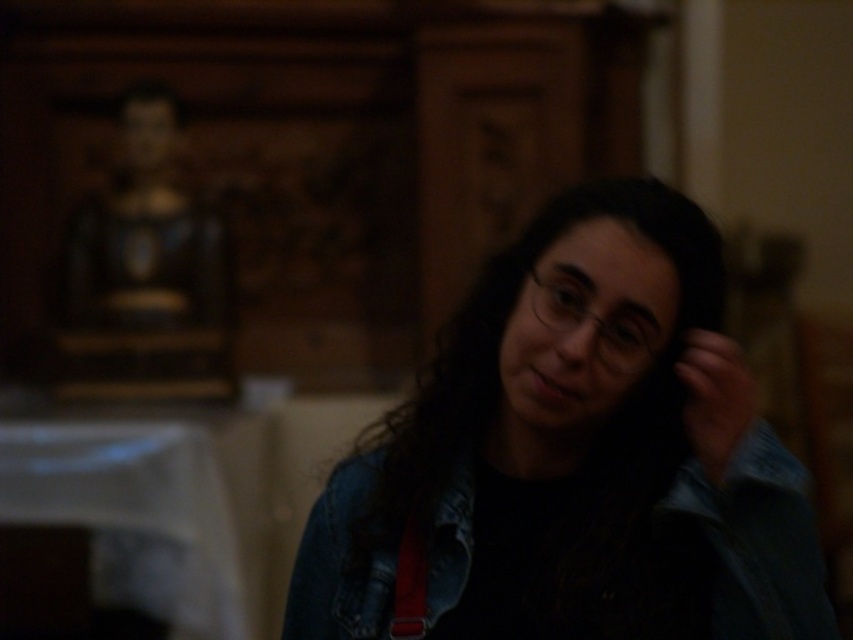
Between point (708, 598) and point (711, 420), which one is positioned in front?

Point (711, 420) is in front.

Does denim jacket at lower right appear under matte black hand at right?

Yes.

Does point (357, 508) come in front of point (685, 360)?

No, it is behind (685, 360).

In order to click on denim jacket at lower right in this screenshot , I will do `click(727, 556)`.

Can you confirm if denim jacket at lower right is shorter than wooden statue at upper left?

Indeed, denim jacket at lower right has a lesser height compared to wooden statue at upper left.

Who is more forward, (663, 577) or (167, 250)?

Point (663, 577)

At what (x,y) coordinates should I click in order to perform the action: click on denim jacket at lower right. Please return your answer as a coordinate pair (x, y). Looking at the image, I should click on (727, 556).

Can you confirm if denim jacket at center is wider than matte black hand at right?

Indeed, denim jacket at center has a greater width compared to matte black hand at right.

Can you confirm if denim jacket at center is shorter than matte black hand at right?

Incorrect, denim jacket at center's height does not fall short of matte black hand at right's.

Is point (611, 392) more distant than point (712, 348)?

Yes, it is behind point (712, 348).

Where is `denim jacket at center`? denim jacket at center is located at coordinates (567, 461).